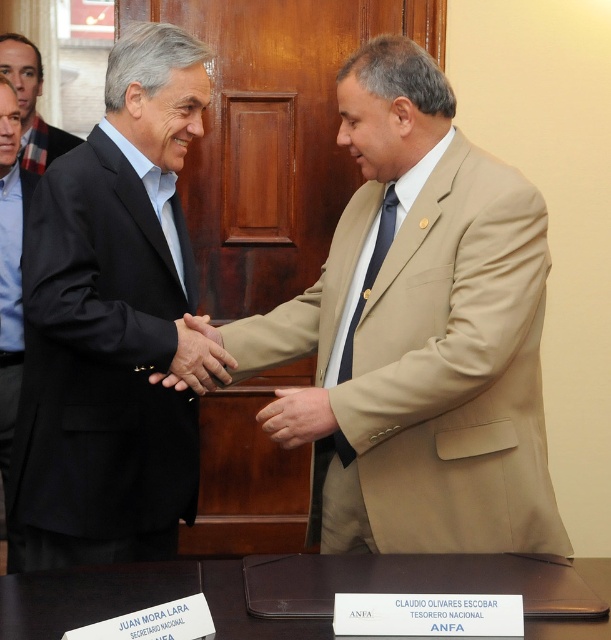
Describe the element at coordinates (196, 356) in the screenshot. I see `brown leather hand at center` at that location.

Between point (185, 314) and point (285, 416), which one is positioned behind?

Positioned behind is point (185, 314).

Locate an element on the screen. Image resolution: width=611 pixels, height=640 pixels. brown leather hand at center is located at coordinates (196, 356).

Can you confirm if light brown suit at left is positioned to the left of brown leather hand at center?

Indeed, light brown suit at left is positioned on the left side of brown leather hand at center.

Is light brown suit at left wider than brown leather hand at center?

No, light brown suit at left is not wider than brown leather hand at center.

You are a GUI agent. You are given a task and a screenshot of the screen. Output one action in this format:
    pyautogui.click(x=<x>, y=<y>)
    Task: Click on the light brown suit at left
    This screenshot has width=611, height=640.
    Given the screenshot: What is the action you would take?
    pyautogui.click(x=10, y=285)

Does matte black suit at center appear on the right side of tan fabric hand at center?

Indeed, matte black suit at center is positioned on the right side of tan fabric hand at center.

Locate an element on the screen. The image size is (611, 640). matte black suit at center is located at coordinates (422, 332).

This screenshot has height=640, width=611. Find the location of `matte black suit at center`. matte black suit at center is located at coordinates [x=422, y=332].